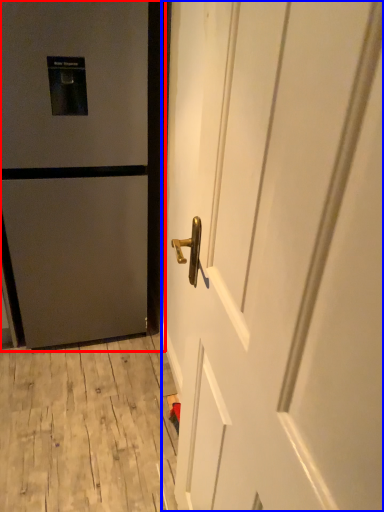
Question: Which object appears closest to the camera in this image, door (highlighted by a red box) or door (highlighted by a blue box)?

Choices:
 (A) door
 (B) door

Answer: (B)